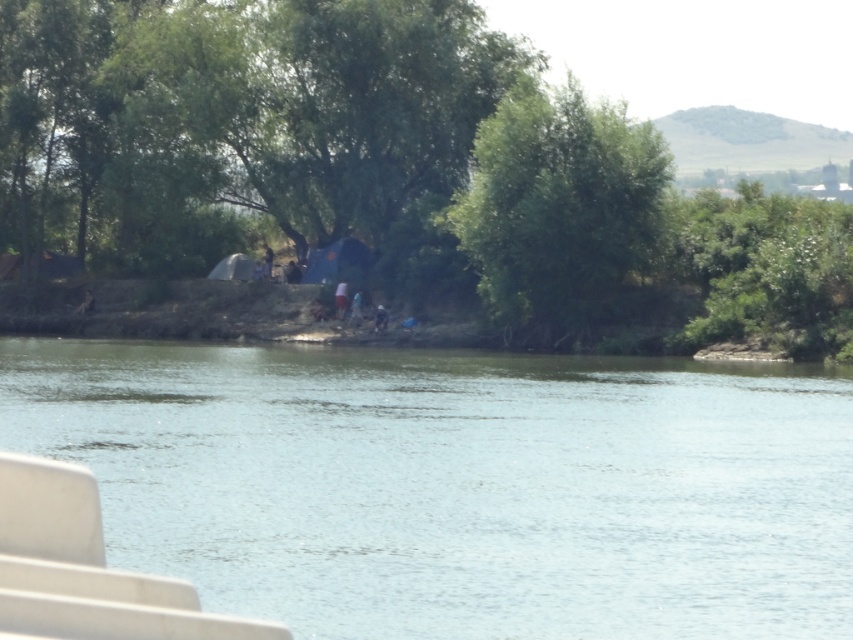
You are navigating a small drone along the riverside path. Your drone has a camera facing forward. You want to capture both the point at coordinates point (234,196) and point (86,348) in the same frame. Which point should you position your drone closer to so that both points are visible in the camera view?

You should position your drone closer to point (86,348) because point (234,196) is behind it. By being nearer to the closer point, the drone can include both points in its field of view.

You are planning to take a photo of the green water at center and the green leafy tree at upper right. Which object should you focus on first if you want to capture both in a single frame without moving the camera?

The green water at center is smaller than the green leafy tree at upper right, so you should focus on the green leafy tree at upper right first to ensure it fits within the frame before adjusting for the smaller green water at center.